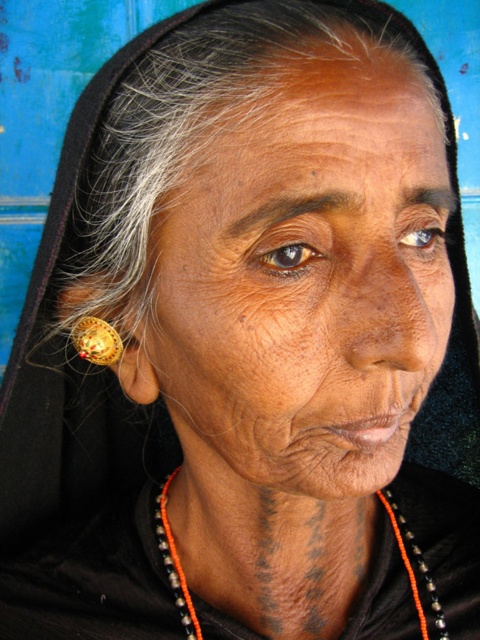
From the picture: You are an artist trying to sketch the portrait. You notice two accessories on the person. Which accessory is positioned lower on the body, the orange beaded necklace at lower center or the gold metallic earring at left?

The orange beaded necklace at lower center is positioned lower on the body than the gold metallic earring at left because it is described as much taller than the earring.